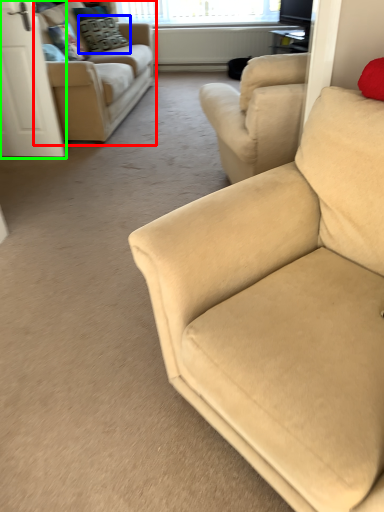
Question: Estimate the real-world distances between objects in this image. Which object is farther from studio couch (highlighted by a red box), pillow (highlighted by a blue box) or screen door (highlighted by a green box)?

Choices:
 (A) pillow
 (B) screen door

Answer: (A)